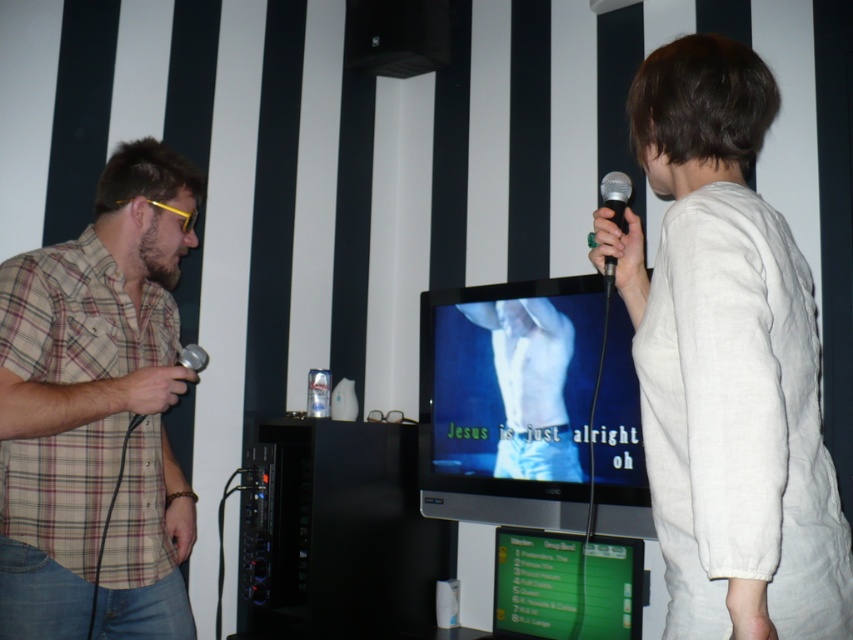
Question: Can you confirm if white cotton shirt at center is positioned below matte black microphone at left?

Choices:
 (A) yes
 (B) no

Answer: (B)

Question: Which point appears farthest from the camera in this image?

Choices:
 (A) (537, 461)
 (B) (619, 173)

Answer: (A)

Question: Does white cotton shirt at center appear on the left side of white matte shirt at center?

Choices:
 (A) no
 (B) yes

Answer: (A)

Question: Which object appears farthest from the camera in this image?

Choices:
 (A) white matte shirt at center
 (B) white cotton shirt at center

Answer: (A)

Question: Which point appears closest to the camera in this image?

Choices:
 (A) (606, 275)
 (B) (128, 260)

Answer: (A)

Question: Does plaid cotton shirt at left appear over black matte microphone at right?

Choices:
 (A) no
 (B) yes

Answer: (A)